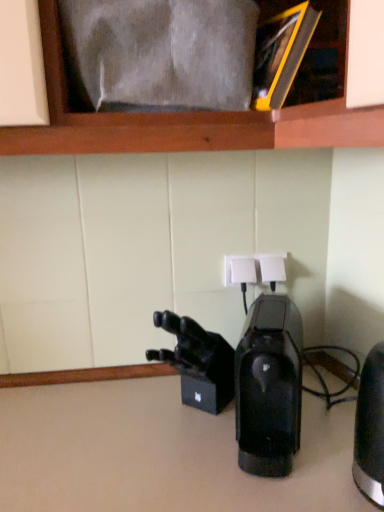
Question: Visually, is black glossy coffee maker at center, marked as the second home appliance in a right-to-left arrangement, positioned to the left or to the right of black metallic kettle at right, which is counted as the 2th home appliance, starting from the left?

Choices:
 (A) right
 (B) left

Answer: (B)

Question: From the image's perspective, is black glossy coffee maker at center, the 1th home appliance when ordered from left to right, above or below black metallic kettle at right, which is counted as the 2th home appliance, starting from the left?

Choices:
 (A) below
 (B) above

Answer: (B)

Question: Estimate the real-world distances between objects in this image. Which object is closer to the black glossy coffee maker at center, the 1th home appliance when ordered from left to right?

Choices:
 (A) black metallic kettle at right, which is counted as the 2th home appliance, starting from the left
 (B) white plastic electrical outlet at center
 (C) black matte/video camera at center

Answer: (C)

Question: Which object is the farthest from the black metallic kettle at right, which is counted as the 2th home appliance, starting from the left?

Choices:
 (A) black glossy coffee maker at center, the 1th home appliance when ordered from left to right
 (B) black matte/video camera at center
 (C) white plastic electrical outlet at center

Answer: (C)